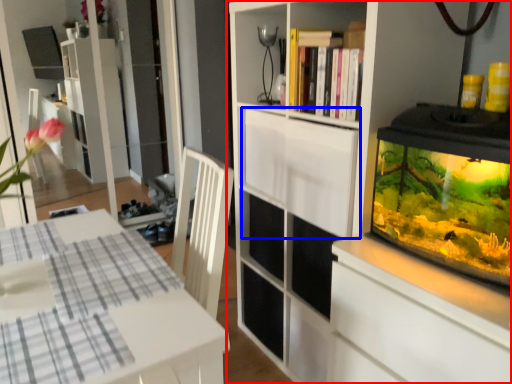
Question: Which object is further to the camera taking this photo, cupboard (highlighted by a red box) or cabinetry (highlighted by a blue box)?

Choices:
 (A) cupboard
 (B) cabinetry

Answer: (B)